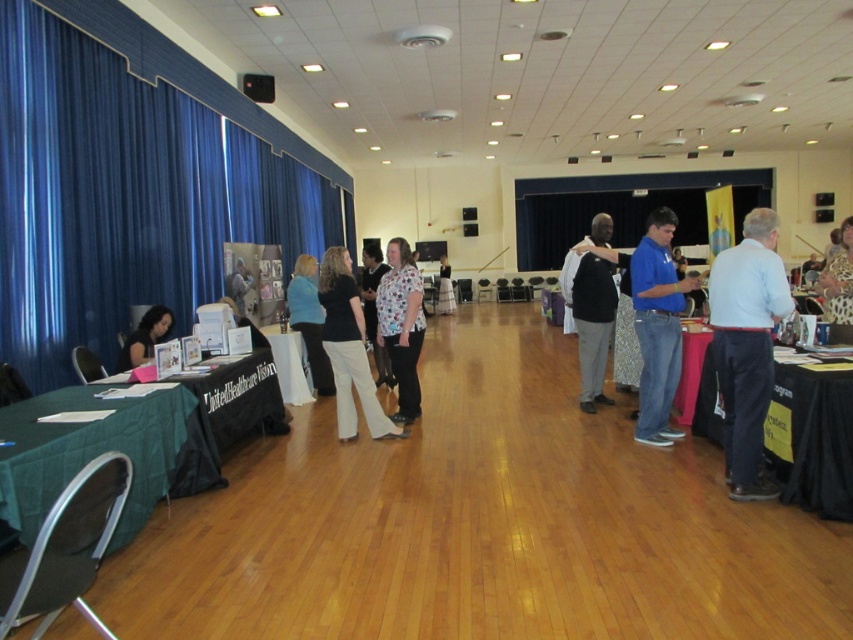
Question: From the image, what is the correct spatial relationship of dark gray suit at center in relation to matte black shirt at center?

Choices:
 (A) above
 (B) below

Answer: (B)

Question: Which point appears farthest from the camera in this image?

Choices:
 (A) (223, 364)
 (B) (834, 282)
 (C) (451, 308)
 (D) (300, 387)

Answer: (C)

Question: Does blue cotton shirt at center appear on the left side of green fabric table at left?

Choices:
 (A) yes
 (B) no

Answer: (B)

Question: Which of the following is the farthest from the observer?

Choices:
 (A) blue cotton shirt at center
 (B) white cotton shirt at center
 (C) light blue shirt at right
 (D) blue fabric pants at center

Answer: (B)

Question: Where is blue fabric curtain at left located in relation to matte black shirt at center in the image?

Choices:
 (A) above
 (B) below

Answer: (A)

Question: Which point appears farthest from the camera in this image?

Choices:
 (A) (836, 275)
 (B) (44, 352)

Answer: (B)